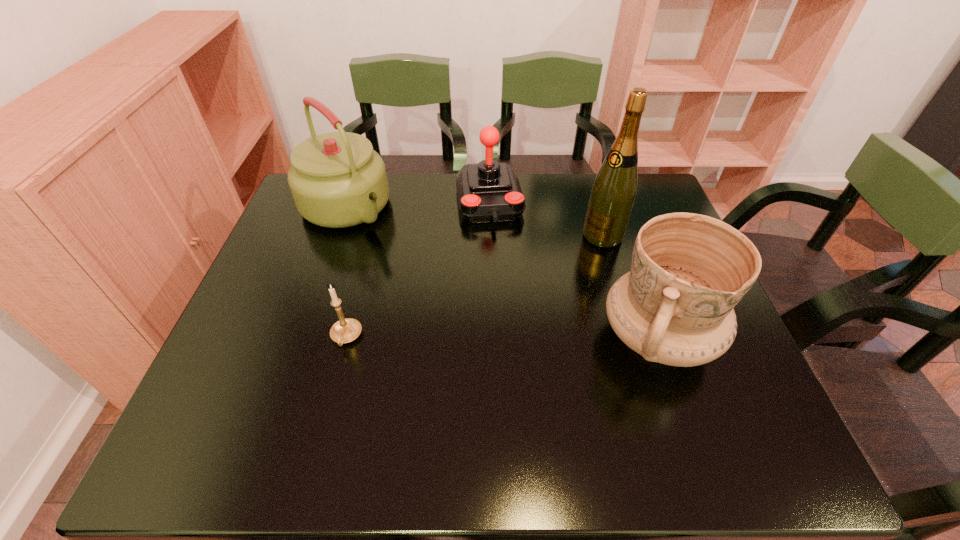
Locate an element on the screen. The width and height of the screenshot is (960, 540). object identified as the third closest to the joystick is located at coordinates (688, 271).

Locate which object ranks fourth in proximity to the second shortest object. Please provide its 2D coordinates. Your answer should be formatted as a tuple, i.e. [(x, y)], where the tuple contains the x and y coordinates of a point satisfying the conditions above.

[(346, 330)]

You are a GUI agent. You are given a task and a screenshot of the screen. Output one action in this format:
    pyautogui.click(x=<x>, y=<y>)
    Task: Click on the vacant space that satisfies the following two spatial constraints: 1. on the front side of the fourth tallest object; 2. on the right side of the tallest object
    
    Given the screenshot: What is the action you would take?
    click(x=491, y=235)

At what (x,y) coordinates should I click in order to perform the action: click on vacant region that satisfies the following two spatial constraints: 1. on the front side of the kettle; 2. on the right side of the third tallest object. Please return your answer as a coordinate pair (x, y). Looking at the image, I should click on (301, 338).

Image resolution: width=960 pixels, height=540 pixels. I want to click on free space that satisfies the following two spatial constraints: 1. on the handle side of the third shortest object; 2. on the left side of the shortest object, so click(347, 338).

Where is `free space that satisfies the following two spatial constraints: 1. on the handle side of the candle holder; 2. on the right side of the pottery`? This screenshot has height=540, width=960. free space that satisfies the following two spatial constraints: 1. on the handle side of the candle holder; 2. on the right side of the pottery is located at coordinates (347, 338).

Where is `blank space that satisfies the following two spatial constraints: 1. on the handle side of the candle holder; 2. on the right side of the pottery`? This screenshot has height=540, width=960. blank space that satisfies the following two spatial constraints: 1. on the handle side of the candle holder; 2. on the right side of the pottery is located at coordinates (347, 338).

The image size is (960, 540). In order to click on vacant area in the image that satisfies the following two spatial constraints: 1. on the front side of the wine bottle; 2. on the left side of the third tallest object in this screenshot , I will do `click(633, 338)`.

Locate an element on the screen. The width and height of the screenshot is (960, 540). free location that satisfies the following two spatial constraints: 1. on the handle side of the shortest object; 2. on the right side of the pottery is located at coordinates (347, 338).

Image resolution: width=960 pixels, height=540 pixels. What are the coordinates of `free space in the image that satisfies the following two spatial constraints: 1. on the front side of the wine bottle; 2. on the right side of the pottery` in the screenshot? It's located at (633, 338).